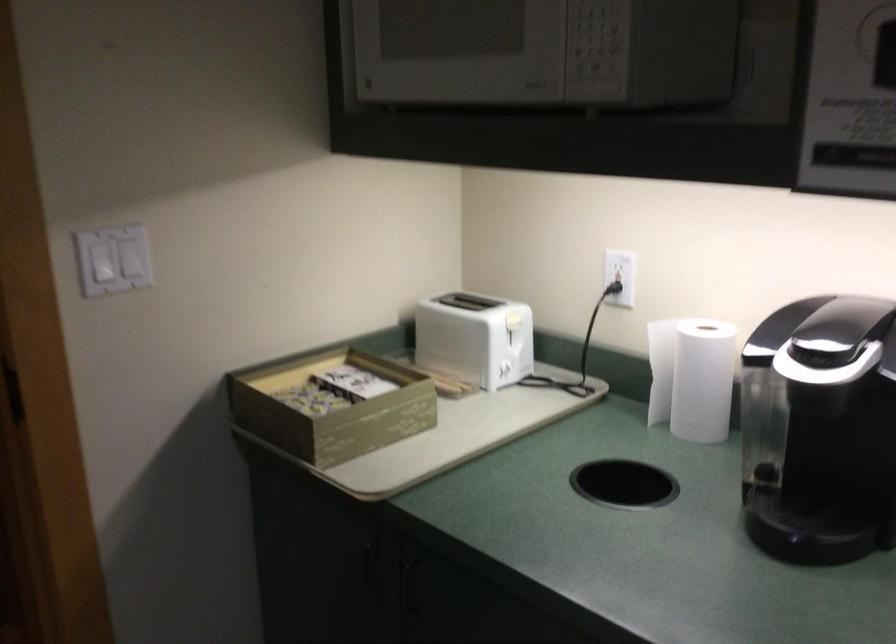
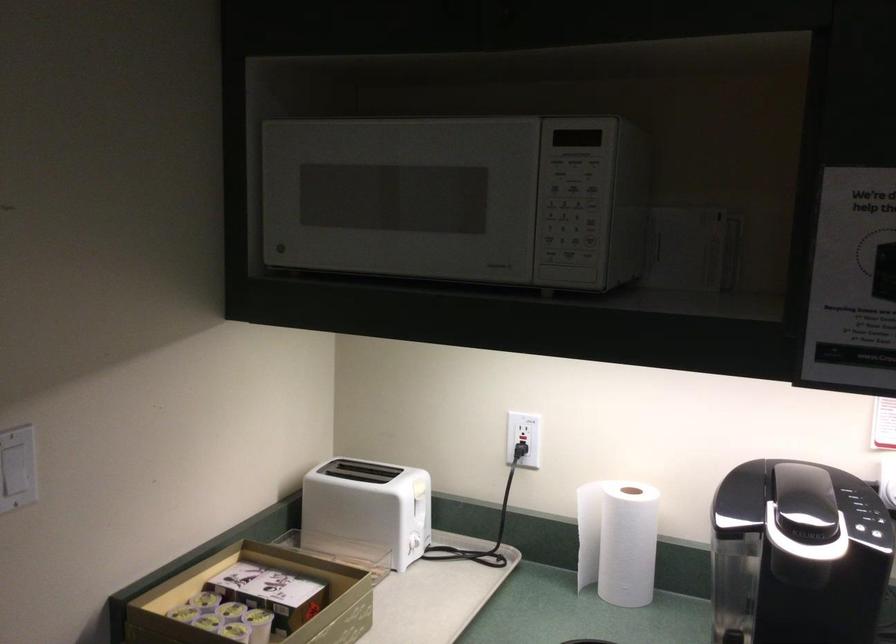
In the second image, find the point that corresponds to (304,384) in the first image.

(204, 597)